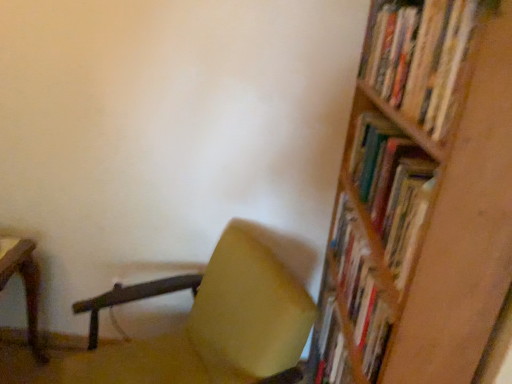
Question: Considering the relative sizes of matte yellow chair at center and wooden bookshelf at right in the image provided, is matte yellow chair at center wider than wooden bookshelf at right?

Choices:
 (A) no
 (B) yes

Answer: (B)

Question: Is the depth of matte yellow chair at center greater than that of wooden bookshelf at right?

Choices:
 (A) yes
 (B) no

Answer: (A)

Question: Is matte yellow chair at center completely or partially outside of wooden bookshelf at right?

Choices:
 (A) yes
 (B) no

Answer: (A)

Question: Would you say wooden bookshelf at right is part of matte yellow chair at center's contents?

Choices:
 (A) no
 (B) yes

Answer: (A)

Question: Does matte yellow chair at center appear on the left side of wooden bookshelf at right?

Choices:
 (A) yes
 (B) no

Answer: (A)

Question: Considering their positions, is wooden bookshelf at upper right located in front of or behind matte yellow chair at center?

Choices:
 (A) front
 (B) behind

Answer: (A)

Question: Is wooden bookshelf at upper right taller or shorter than matte yellow chair at center?

Choices:
 (A) short
 (B) tall

Answer: (A)

Question: Is point (470, 8) closer or farther from the camera than point (256, 241)?

Choices:
 (A) farther
 (B) closer

Answer: (B)

Question: From a real-world perspective, is wooden bookshelf at upper right physically located above or below matte yellow chair at center?

Choices:
 (A) above
 (B) below

Answer: (A)

Question: Considering their positions, is wooden bookshelf at right located in front of or behind wooden bookshelf at upper right?

Choices:
 (A) behind
 (B) front

Answer: (B)

Question: Is wooden bookshelf at right to the left or to the right of wooden bookshelf at upper right in the image?

Choices:
 (A) right
 (B) left

Answer: (B)

Question: Is point (414, 31) positioned closer to the camera than point (381, 31)?

Choices:
 (A) closer
 (B) farther

Answer: (A)

Question: From the image's perspective, is wooden bookshelf at right positioned above or below wooden bookshelf at upper right?

Choices:
 (A) below
 (B) above

Answer: (A)

Question: Is wooden bookshelf at right wider or thinner than matte yellow chair at center?

Choices:
 (A) wide
 (B) thin

Answer: (B)

Question: Is wooden bookshelf at right spatially inside matte yellow chair at center, or outside of it?

Choices:
 (A) inside
 (B) outside

Answer: (B)